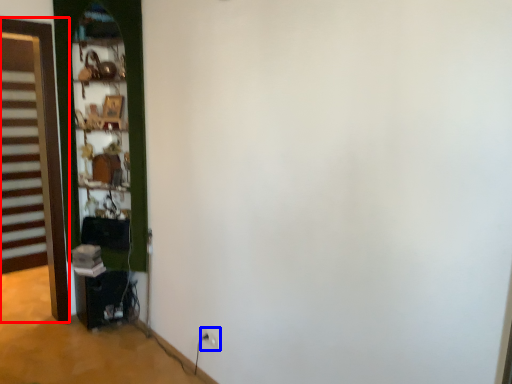
Question: Which point is further to the camera, door (highlighted by a red box) or electric outlet (highlighted by a blue box)?

Choices:
 (A) door
 (B) electric outlet

Answer: (A)